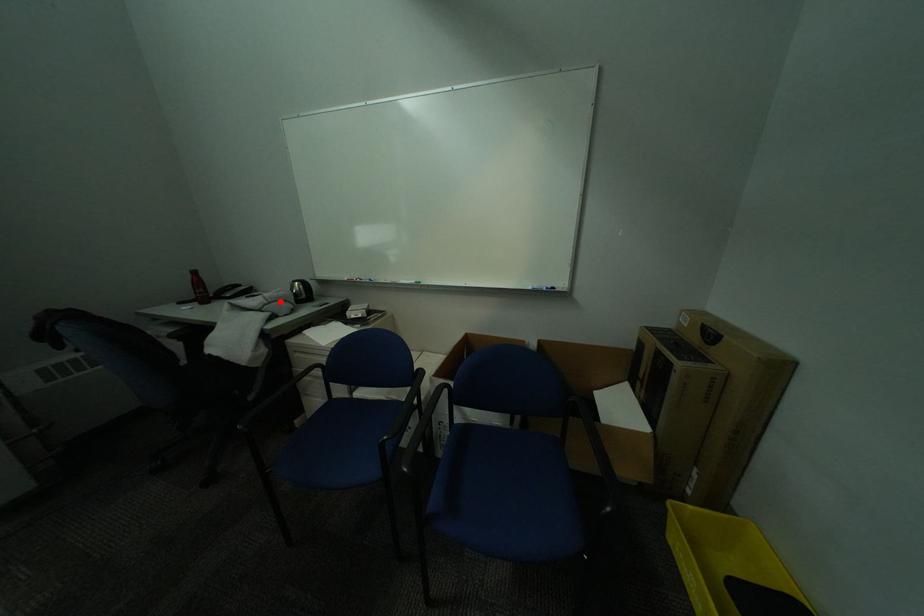
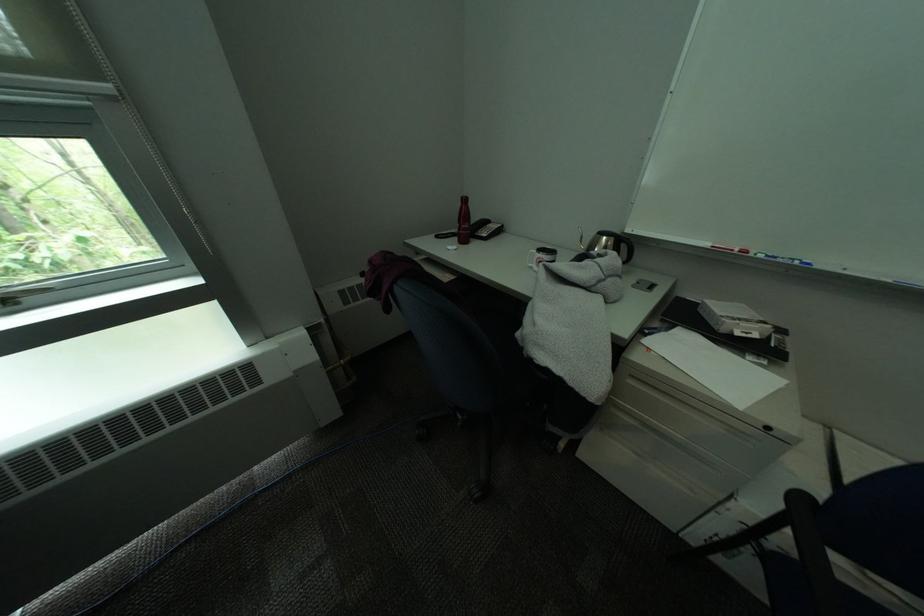
In the second image, find the point that corresponds to the highlighted location in the first image.

(615, 274)